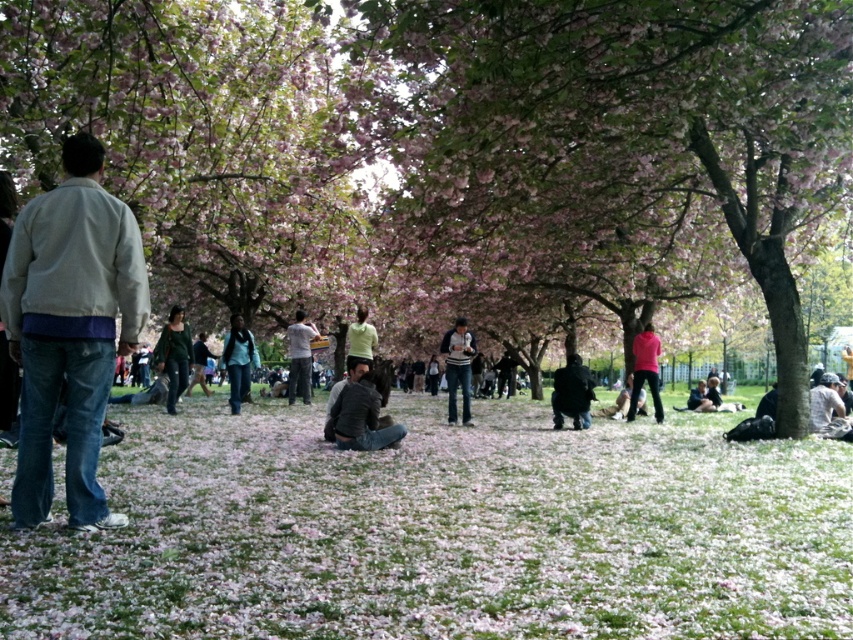
You are a photographer standing in the park and want to take a photo of the two people wearing the denim jacket at center and green matte shirt at center. Which person should you focus on first if you want to capture the taller one in your frame?

The denim jacket at center is taller than the green matte shirt at center, so you should focus on the person wearing the denim jacket at center first.